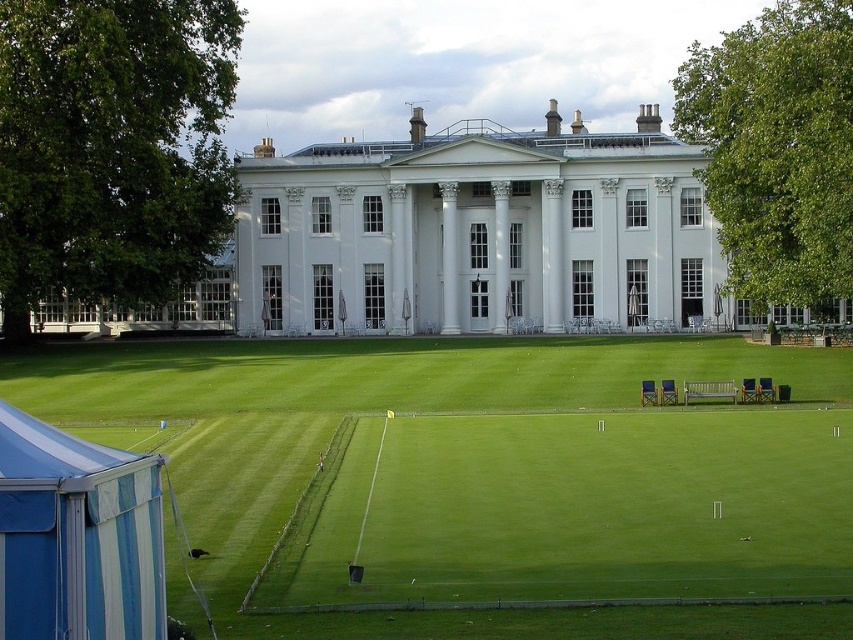
Question: Is green grass at center to the left of blue striped tent at lower left from the viewer's perspective?

Choices:
 (A) yes
 (B) no

Answer: (B)

Question: Which of the following is the farthest from the observer?

Choices:
 (A) blue striped tent at lower left
 (B) green grass at center

Answer: (B)

Question: Is green grass at center smaller than blue striped tent at lower left?

Choices:
 (A) no
 (B) yes

Answer: (A)

Question: Is green grass at center further to camera compared to blue striped tent at lower left?

Choices:
 (A) yes
 (B) no

Answer: (A)

Question: Which point is farther to the camera?

Choices:
 (A) green grass at center
 (B) blue striped tent at lower left

Answer: (A)